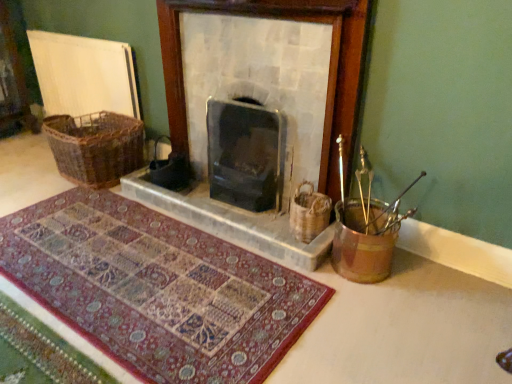
Question: Is woven brown basket at right, marked as the first basket in a right-to-left arrangement, aimed at metallic gold bucket at right?

Choices:
 (A) no
 (B) yes

Answer: (A)

Question: From a real-world perspective, is woven brown basket at right, marked as the first basket in a bottom-to-top arrangement, positioned over metallic gold bucket at right based on gravity?

Choices:
 (A) yes
 (B) no

Answer: (A)

Question: Does woven brown basket at right, the second basket positioned from the left, have a smaller size compared to metallic gold bucket at right?

Choices:
 (A) yes
 (B) no

Answer: (A)

Question: From a real-world perspective, is woven brown basket at right, the second basket viewed from the top, located beneath metallic gold bucket at right?

Choices:
 (A) no
 (B) yes

Answer: (A)

Question: Is woven brown basket at right, the second basket viewed from the top, closer to the viewer compared to metallic gold bucket at right?

Choices:
 (A) yes
 (B) no

Answer: (B)

Question: Is woven brown basket at right, marked as the 1th basket in a front-to-back arrangement, looking in the opposite direction of metallic gold bucket at right?

Choices:
 (A) yes
 (B) no

Answer: (B)

Question: Is metallic gold bucket at right positioned behind stone fireplace at center?

Choices:
 (A) yes
 (B) no

Answer: (B)

Question: Does metallic gold bucket at right have a lesser height compared to stone fireplace at center?

Choices:
 (A) no
 (B) yes

Answer: (B)

Question: Is metallic gold bucket at right looking in the opposite direction of stone fireplace at center?

Choices:
 (A) yes
 (B) no

Answer: (B)

Question: From the image's perspective, does metallic gold bucket at right appear lower than stone fireplace at center?

Choices:
 (A) no
 (B) yes

Answer: (B)

Question: Is metallic gold bucket at right wider than stone fireplace at center?

Choices:
 (A) no
 (B) yes

Answer: (B)

Question: From the image's perspective, is metallic gold bucket at right above stone fireplace at center?

Choices:
 (A) no
 (B) yes

Answer: (A)

Question: Is metallic gold bucket at right shorter than carpeted mat at center?

Choices:
 (A) yes
 (B) no

Answer: (B)